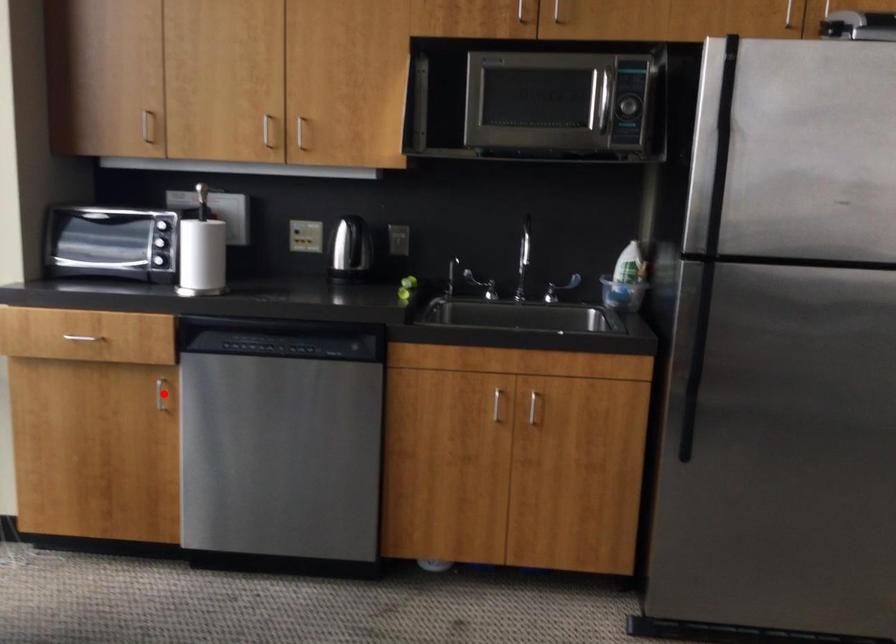
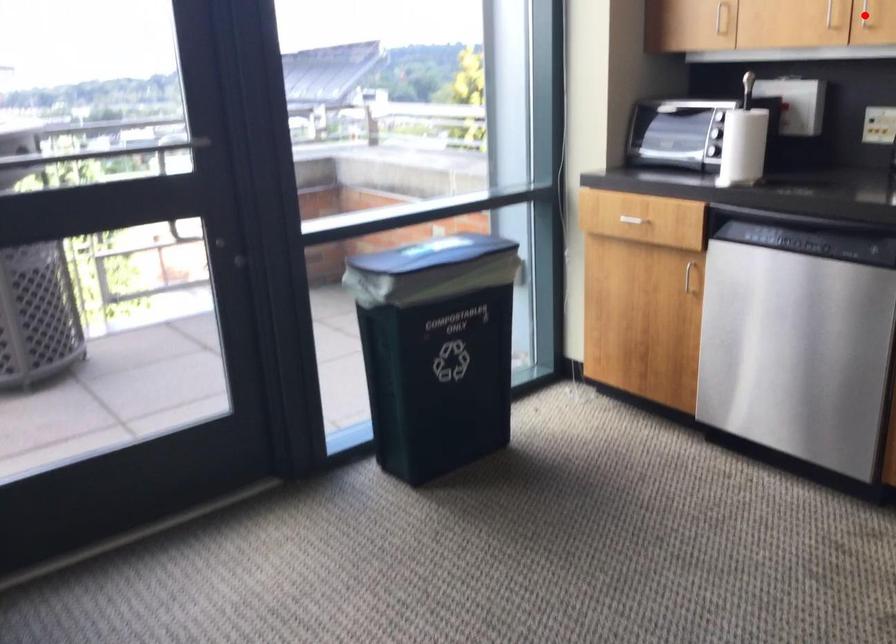
I am providing you with two images of the same scene from different viewpoints. A red point is marked on the first image and another point is marked on the second image. Are the points marked in image1 and image2 representing the same 3D position?

No